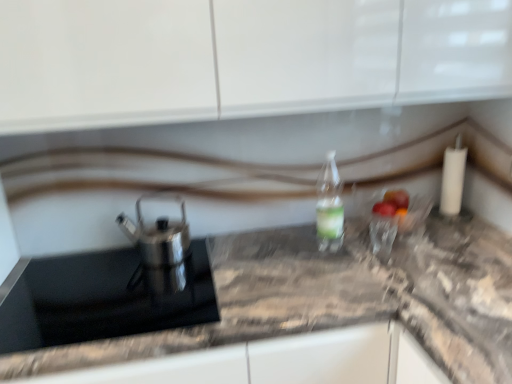
Question: Is black glass sink at left positioned in front of clear plastic bottle at center?

Choices:
 (A) yes
 (B) no

Answer: (A)

Question: Is black glass sink at left wider than clear plastic bottle at center?

Choices:
 (A) no
 (B) yes

Answer: (B)

Question: Could you tell me if black glass sink at left is turned towards clear plastic bottle at center?

Choices:
 (A) yes
 (B) no

Answer: (B)

Question: Considering the relative positions of black glass sink at left and clear plastic bottle at center in the image provided, is black glass sink at left to the left of clear plastic bottle at center from the viewer's perspective?

Choices:
 (A) yes
 (B) no

Answer: (A)

Question: Is black glass sink at left looking in the opposite direction of clear plastic bottle at center?

Choices:
 (A) yes
 (B) no

Answer: (B)

Question: Is black glass sink at left shorter than clear plastic bottle at center?

Choices:
 (A) no
 (B) yes

Answer: (B)

Question: Considering the relative positions of marble gray countertop at center and satin silver teapot at left in the image provided, is marble gray countertop at center to the left of satin silver teapot at left from the viewer's perspective?

Choices:
 (A) yes
 (B) no

Answer: (B)

Question: Is marble gray countertop at center facing away from satin silver teapot at left?

Choices:
 (A) no
 (B) yes

Answer: (A)

Question: Is marble gray countertop at center touching satin silver teapot at left?

Choices:
 (A) yes
 (B) no

Answer: (B)

Question: From the image's perspective, is marble gray countertop at center over satin silver teapot at left?

Choices:
 (A) no
 (B) yes

Answer: (A)

Question: From a real-world perspective, does marble gray countertop at center sit lower than satin silver teapot at left?

Choices:
 (A) yes
 (B) no

Answer: (A)

Question: Is marble gray countertop at center wider than satin silver teapot at left?

Choices:
 (A) no
 (B) yes

Answer: (B)

Question: Considering the relative sizes of clear plastic bottle at center and satin silver teapot at left in the image provided, is clear plastic bottle at center taller than satin silver teapot at left?

Choices:
 (A) no
 (B) yes

Answer: (B)